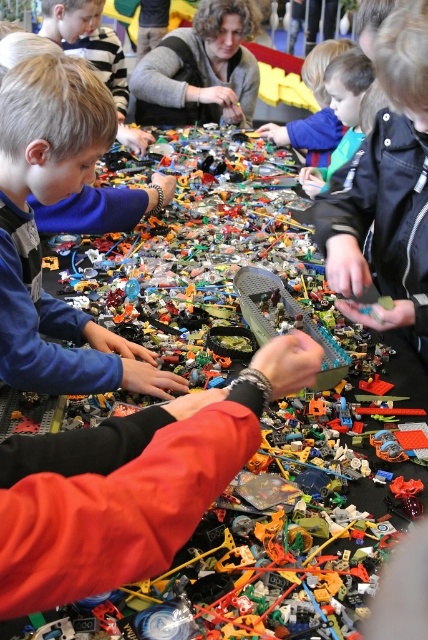
Does point (226, 435) lie in front of point (228, 93)?

That is True.

Find the location of a particular element. This screenshot has width=428, height=640. matte black arm at center is located at coordinates (137, 493).

At what (x,y) coordinates should I click in order to perform the action: click on matte black arm at center. Please return your answer as a coordinate pair (x, y). This screenshot has height=640, width=428. Looking at the image, I should click on (137, 493).

Between blue matte shirt at left and green matte toy car at center, which one appears on the left side from the viewer's perspective?

blue matte shirt at left is more to the left.

Does blue matte shirt at left appear on the right side of green matte toy car at center?

No, blue matte shirt at left is not to the right of green matte toy car at center.

Locate an element on the screen. This screenshot has width=428, height=640. blue matte shirt at left is located at coordinates (50, 129).

Between matte black arm at center and green matte toy car at center, which one has less height?

Standing shorter between the two is matte black arm at center.

Where is `matte black arm at center`? Image resolution: width=428 pixels, height=640 pixels. matte black arm at center is located at coordinates (137, 493).

Between point (79, 509) and point (391, 282), which one is positioned in front?

Point (79, 509) is more forward.

This screenshot has height=640, width=428. I want to click on matte black arm at center, so click(137, 493).